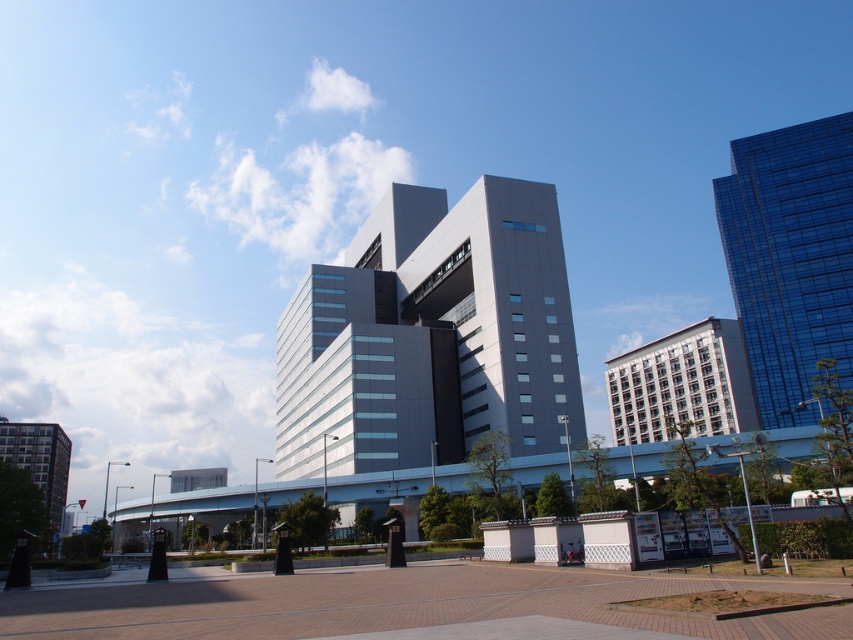
You are standing at the intersection and see the sleek gray building at center and the matte gray building at lower left. Which building is positioned to the right side from your perspective?

The sleek gray building at center is positioned to the right of the matte gray building at lower left.

You are standing in the urban landscape and want to walk towards the point at the coordinates given. Which point, point at (503, 429) or point at (744, 326), will you reach first?

Point at (503, 429) is in front of point at (744, 326), so you will reach point at (503, 429) first.

You are a city planner evaluating the urban layout. Based on the image, which building occupies more horizontal space in the scene? The sleek gray building at center or the shiny glass building at upper right?

The sleek gray building at center might be wider than shiny glass building at upper right.